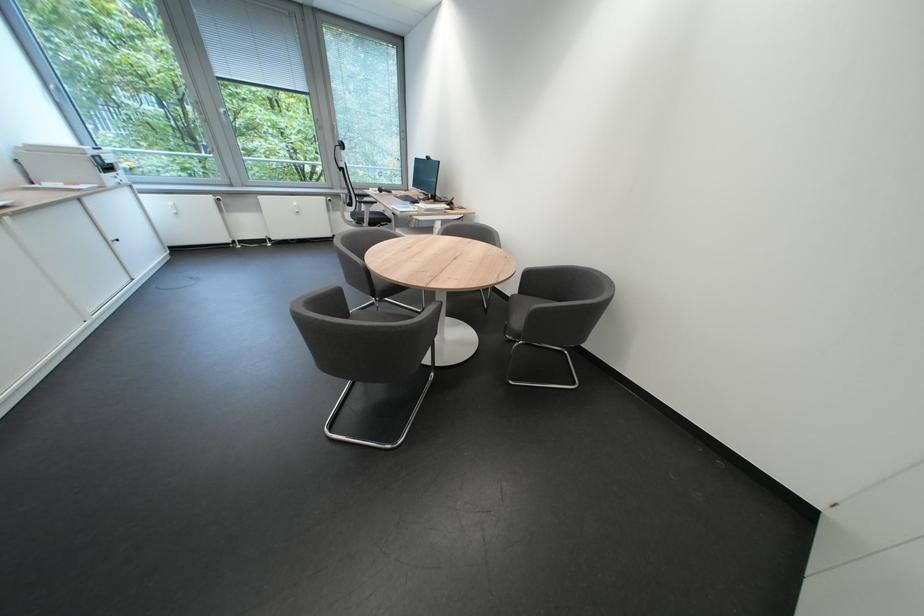
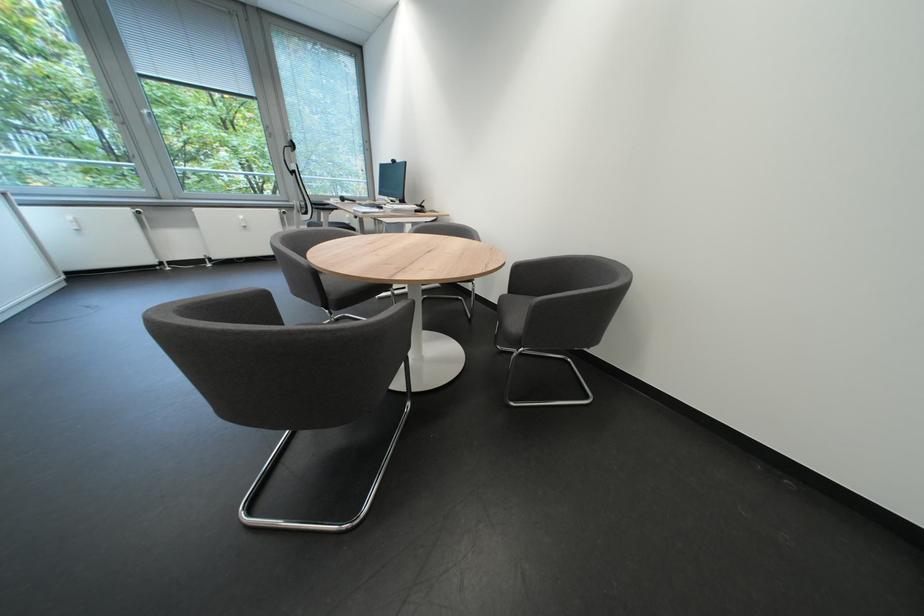
Where in the second image is the point corresponding to point (296, 127) from the first image?

(248, 146)